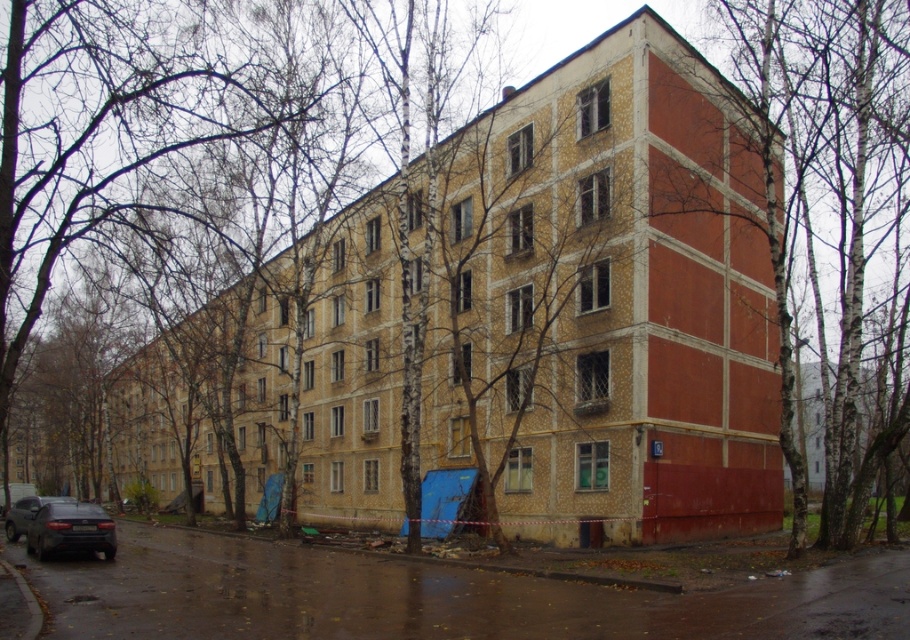
Does smooth bark tree at center come in front of dark gray metallic car at lower left?

Yes, smooth bark tree at center is in front of dark gray metallic car at lower left.

The image size is (910, 640). What do you see at coordinates (826, 204) in the screenshot?
I see `smooth bark tree at center` at bounding box center [826, 204].

The height and width of the screenshot is (640, 910). I want to click on smooth bark tree at center, so click(x=826, y=204).

Is dark gray metallic car at lower left positioned before shiny black car at lower left?

Yes, dark gray metallic car at lower left is in front of shiny black car at lower left.

Between dark gray metallic car at lower left and shiny black car at lower left, which one appears on the left side from the viewer's perspective?

Positioned to the left is shiny black car at lower left.

Locate an element on the screen. Image resolution: width=910 pixels, height=640 pixels. dark gray metallic car at lower left is located at coordinates (69, 531).

Where is `dark gray metallic car at lower left`? The width and height of the screenshot is (910, 640). dark gray metallic car at lower left is located at coordinates (69, 531).

Describe the element at coordinates (826, 204) in the screenshot. The width and height of the screenshot is (910, 640). I see `smooth bark tree at center` at that location.

Who is positioned more to the right, smooth bark tree at center or shiny black car at lower left?

smooth bark tree at center

Measure the distance between point [756,189] and camera.

They are 32.22 meters apart.

This screenshot has height=640, width=910. What are the coordinates of `smooth bark tree at center` in the screenshot? It's located at (826, 204).